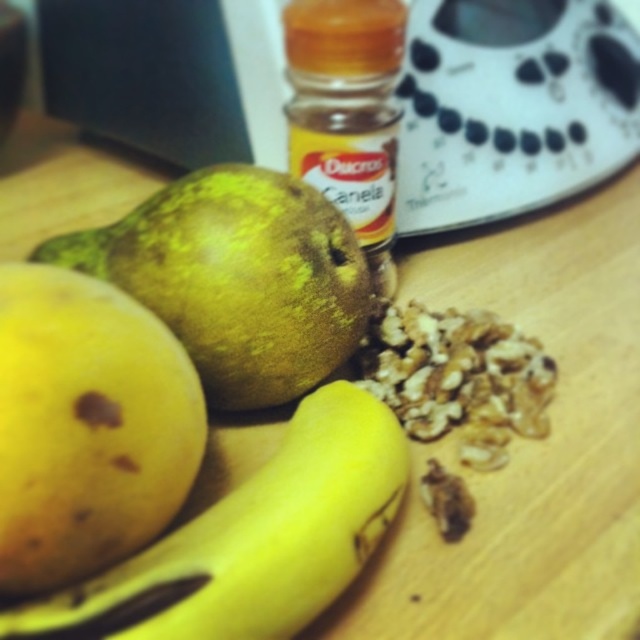
Can you confirm if yellow matte apple at lower left is positioned below green matte pear at center?

Correct, yellow matte apple at lower left is located below green matte pear at center.

Which is in front, point (97, 460) or point (257, 237)?

Point (97, 460) is more forward.

Identify the location of yellow matte apple at lower left. (88, 426).

Measure the distance from yellow matte apple at lower left to yellow matte banana at center.

yellow matte apple at lower left is 3.78 inches away from yellow matte banana at center.

Can you confirm if yellow matte apple at lower left is bigger than yellow matte banana at center?

Actually, yellow matte apple at lower left might be smaller than yellow matte banana at center.

Between point (145, 484) and point (193, 556), which one is positioned in front?

Point (193, 556) is in front.

Identify the location of yellow matte apple at lower left. This screenshot has width=640, height=640. (88, 426).

Who is lower down, green matte pear at center or yellow matte banana at center?

Positioned lower is yellow matte banana at center.

Is green matte pear at center closer to camera compared to yellow matte banana at center?

No.

Who is more forward, (x=100, y=243) or (x=349, y=432)?

Positioned in front is point (x=349, y=432).

Locate an element on the screen. This screenshot has height=640, width=640. green matte pear at center is located at coordinates (237, 278).